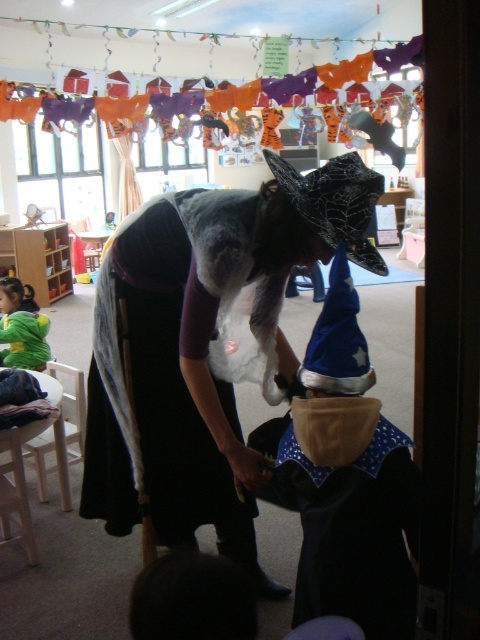
Which of these two, velvet black cape at center or green fuzzy sweater at lower left, stands shorter?

With less height is green fuzzy sweater at lower left.

Which is behind, point (243, 227) or point (28, 356)?

The point (28, 356) is more distant.

The image size is (480, 640). What are the coordinates of `velvet black cape at center` in the screenshot? It's located at (203, 346).

Locate an element on the screen. Image resolution: width=480 pixels, height=640 pixels. velvet black cape at center is located at coordinates point(203,346).

Does velvet black cape at center have a greater width compared to blue felt hat at center?

Yes.

Can you confirm if velvet black cape at center is positioned below blue felt hat at center?

No.

Where is `velvet black cape at center`? This screenshot has width=480, height=640. velvet black cape at center is located at coordinates (203, 346).

Consider the image. Is blue felt hat at center positioned in front of green fuzzy sweater at lower left?

That is True.

In the scene shown: Is blue felt hat at center bigger than green fuzzy sweater at lower left?

Correct, blue felt hat at center is larger in size than green fuzzy sweater at lower left.

What are the coordinates of `blue felt hat at center` in the screenshot? It's located at (x=346, y=480).

Where is `blue felt hat at center`? This screenshot has width=480, height=640. blue felt hat at center is located at coordinates (346, 480).